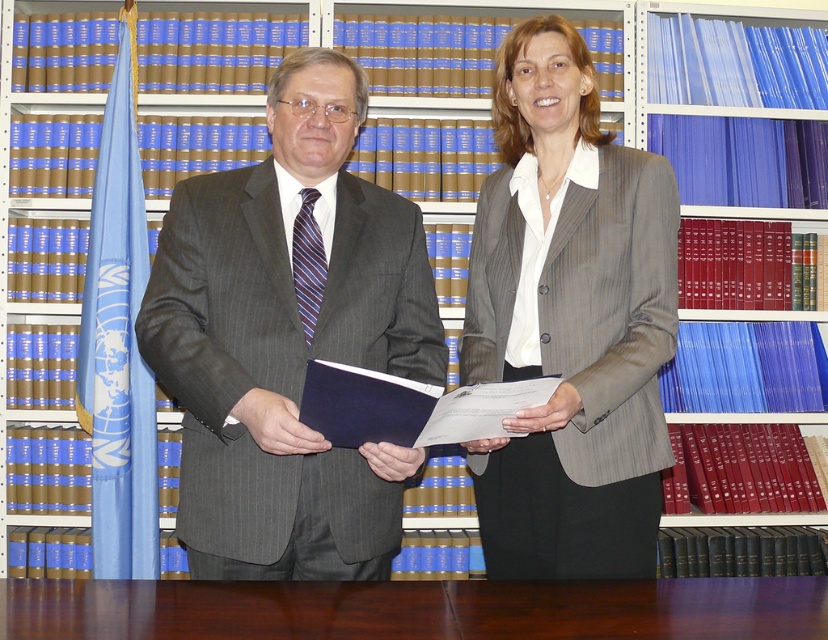
From the picture: You are a guest entering a formal office and see the matte gray suit at center and the brown wood table at center. Which object is closer to the entrance?

The matte gray suit at center is closer to the entrance because the brown wood table at center is behind it.